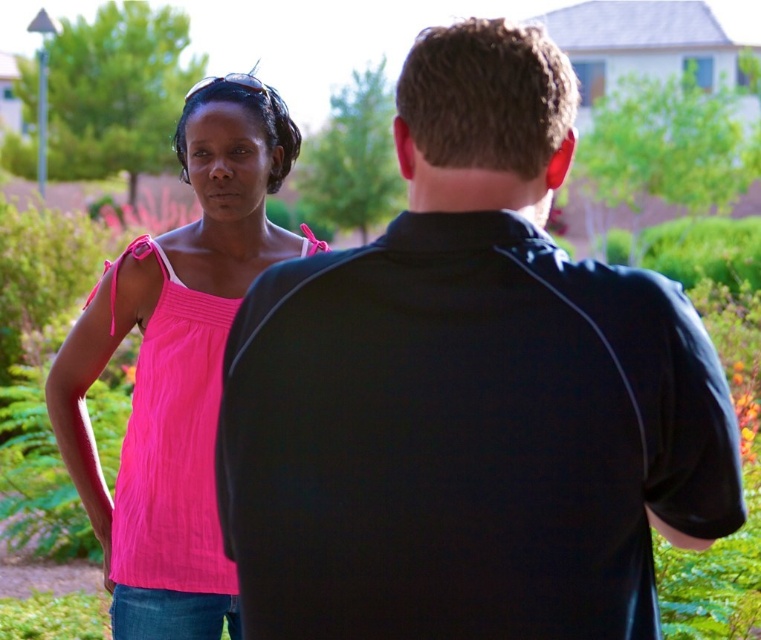
You are a photographer trying to capture a clear shot of the pink fabric top at left and the matte pink tank top at left. Since both are at the same location, which one is more likely to be visible in your photo?

The pink fabric top at left is in front of the matte pink tank top at left, so it will be more visible in the photo.

You are a photographer positioned 10 feet away from the camera. You want to take a portrait of the black matte shirt at center. Can you move closer to the subject without exceeding the 10 feet limit?

The black matte shirt at center is 5.67 feet away from the camera. Since you are positioned 10 feet away from the camera, you can move closer to the subject as long as your distance from the camera does not exceed 10 feet. The minimum distance you can get to the subject is 5.67 feet, which is within the limit.

You are a photographer trying to capture a candid shot of both the black matte shirt at center and the matte pink tank top at left. Since you want to ensure both are visible in the frame, which person should you position closer to the camera?

You should position the matte pink tank top at left closer to the camera because the black matte shirt at center is currently in front of it, potentially blocking the view of the matte pink tank top at left.